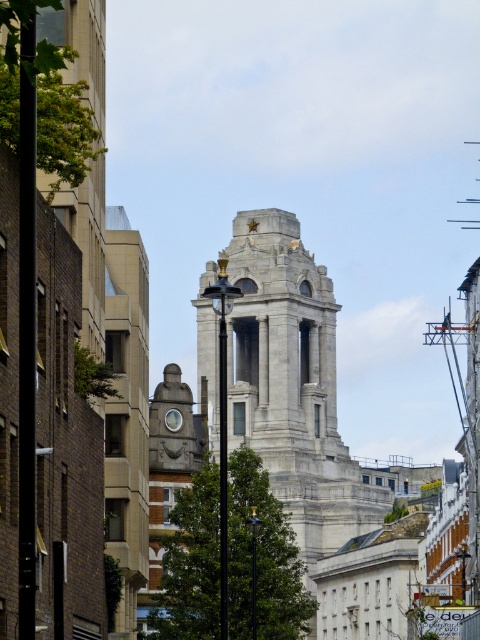
Question: Does gray stone tower at center appear on the left side of matte gray clock at center?

Choices:
 (A) yes
 (B) no

Answer: (B)

Question: In this image, where is gray stone tower at center located relative to matte gray clock at center?

Choices:
 (A) below
 (B) above

Answer: (A)

Question: Does gray stone tower at center come behind matte gray clock at center?

Choices:
 (A) yes
 (B) no

Answer: (A)